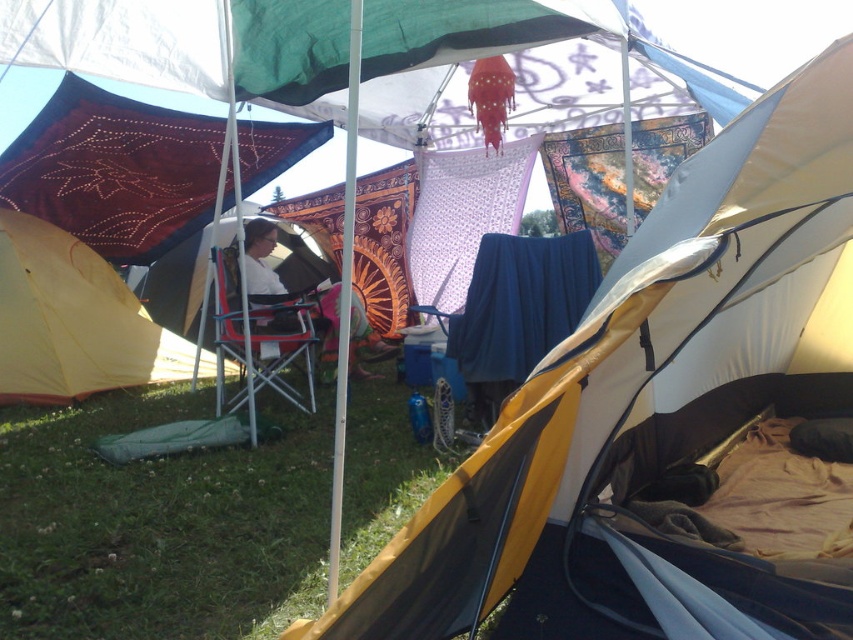
Question: Observing the image, what is the correct spatial positioning of yellow fabric tent at center in reference to white fabric chair at center?

Choices:
 (A) below
 (B) above

Answer: (A)

Question: Is yellow fabric tent at center positioned before green grass at lower left?

Choices:
 (A) no
 (B) yes

Answer: (B)

Question: Which object is farther from the camera taking this photo?

Choices:
 (A) yellow fabric tent at center
 (B) white fabric chair at center
 (C) green grass at lower left
 (D) yellow fabric tent at left

Answer: (B)

Question: Is green grass at lower left in front of yellow fabric tent at left?

Choices:
 (A) yes
 (B) no

Answer: (A)

Question: Which point is farther to the camera?

Choices:
 (A) (529, 621)
 (B) (323, 346)
 (C) (112, 353)

Answer: (B)

Question: Estimate the real-world distances between objects in this image. Which object is farther from the white fabric chair at center?

Choices:
 (A) yellow fabric tent at center
 (B) yellow fabric tent at left

Answer: (A)